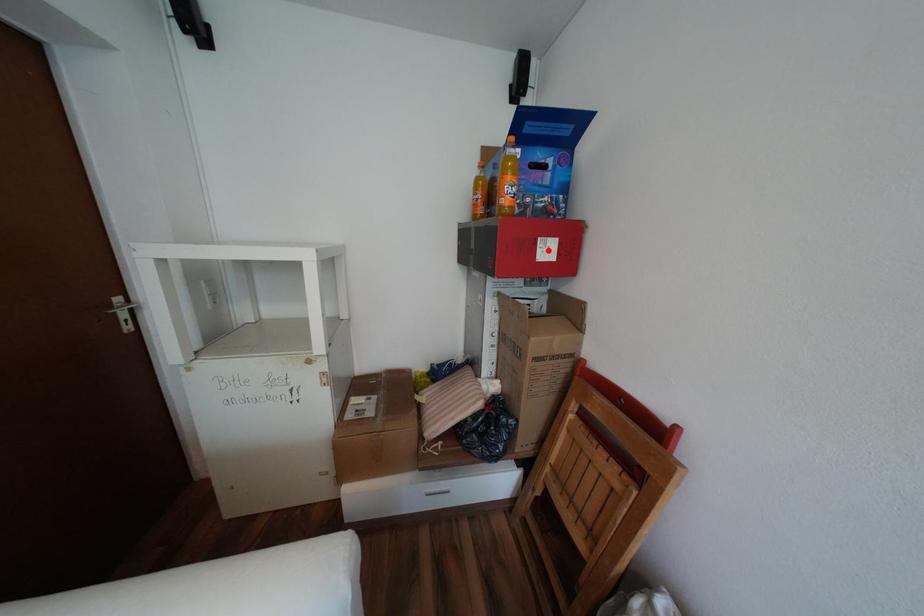
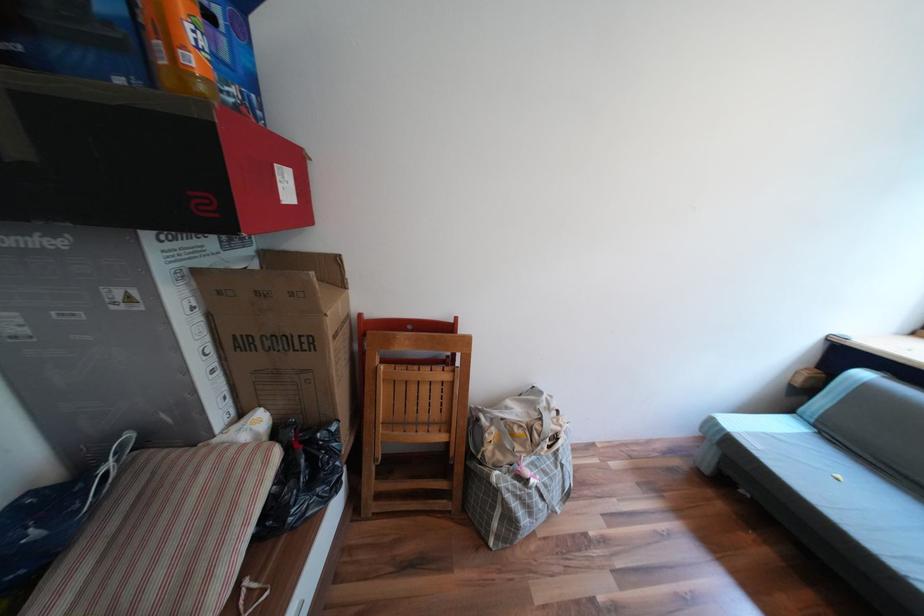
The point at the highlighted location is marked in the first image. Where is the corresponding point in the second image?

(289, 185)